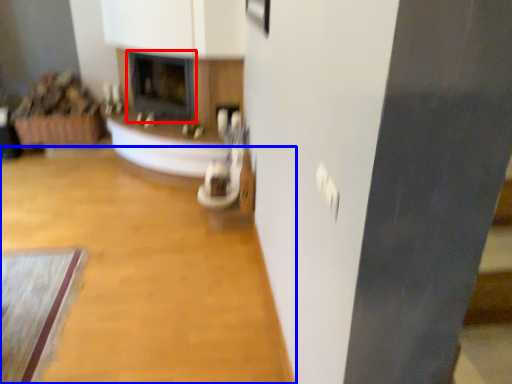
Question: Which object is further to the camera taking this photo, fireplace (highlighted by a red box) or plain (highlighted by a blue box)?

Choices:
 (A) fireplace
 (B) plain

Answer: (A)